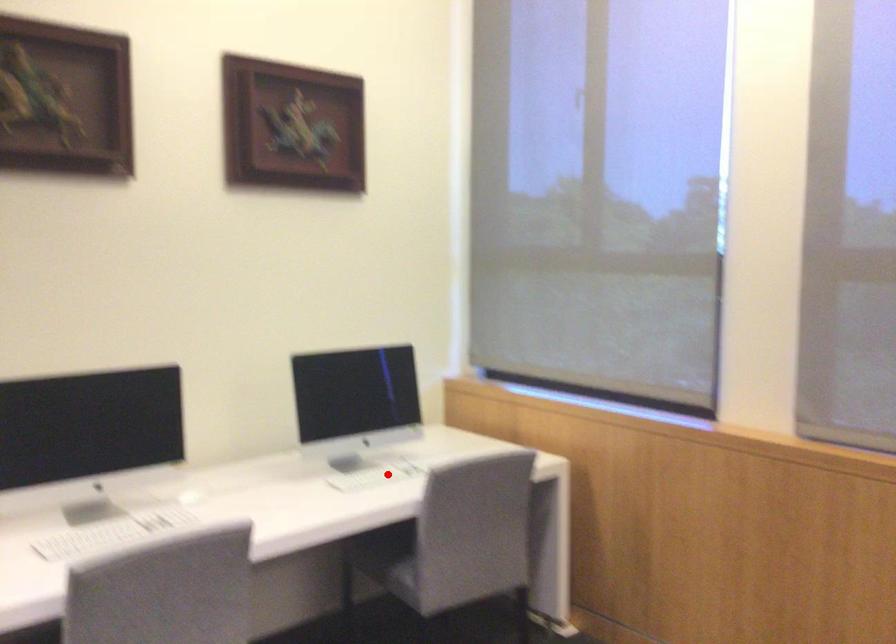
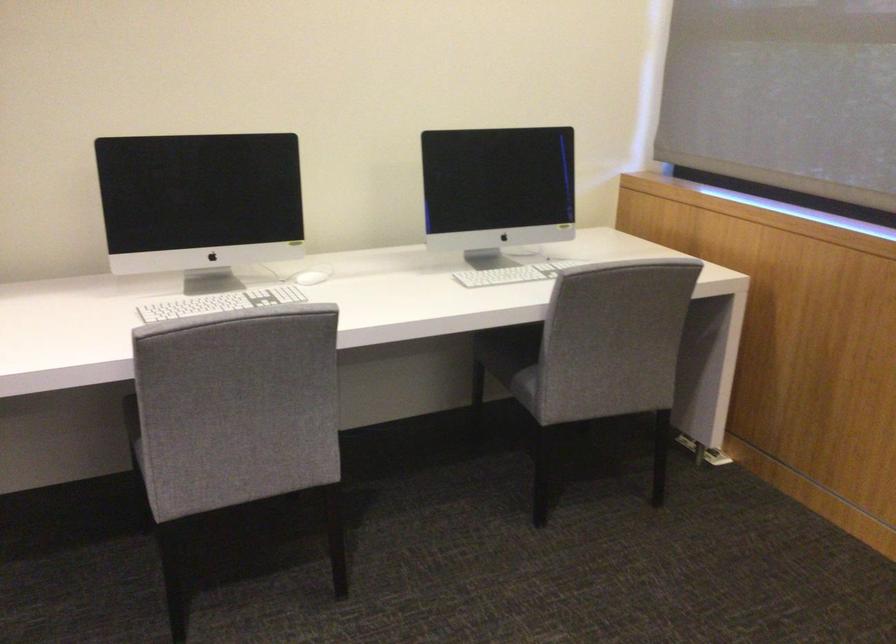
Locate, in the second image, the point that corresponds to the highlighted location in the first image.

(519, 270)